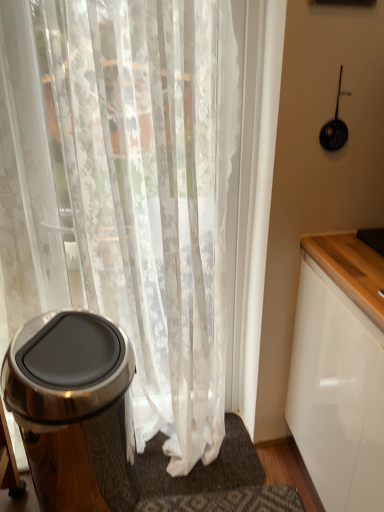
I want to click on free spot to the right of polished stainless steel trash can at left, so click(x=186, y=479).